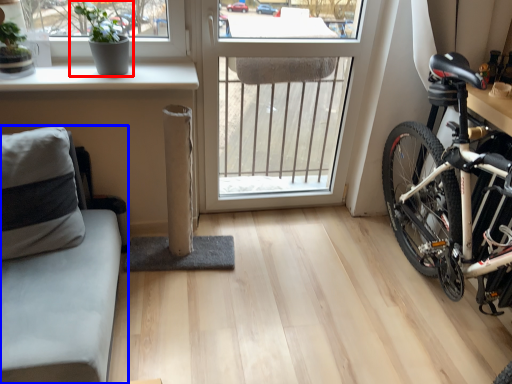
Question: Which point is closer to the camera, houseplant (highlighted by a red box) or studio couch (highlighted by a blue box)?

Choices:
 (A) houseplant
 (B) studio couch

Answer: (B)